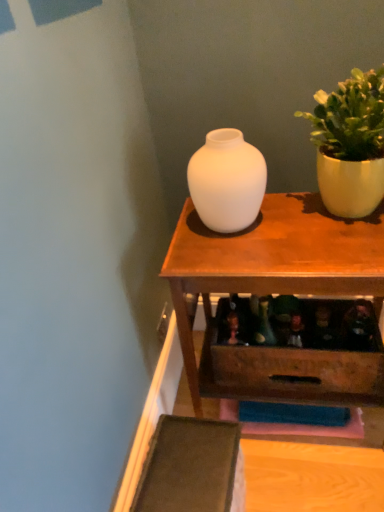
Question: From the image's perspective, is matte wood table at center below matte yellow pot at upper right?

Choices:
 (A) yes
 (B) no

Answer: (A)

Question: Does matte wood table at center have a greater width compared to matte yellow pot at upper right?

Choices:
 (A) no
 (B) yes

Answer: (B)

Question: Is matte wood table at center bigger than matte yellow pot at upper right?

Choices:
 (A) yes
 (B) no

Answer: (A)

Question: Considering the relative sizes of matte wood table at center and matte yellow pot at upper right in the image provided, is matte wood table at center smaller than matte yellow pot at upper right?

Choices:
 (A) yes
 (B) no

Answer: (B)

Question: Is matte wood table at center positioned far away from matte yellow pot at upper right?

Choices:
 (A) yes
 (B) no

Answer: (B)

Question: Looking at their shapes, would you say matte wood table at center is wider or thinner than matte yellow pot at upper right?

Choices:
 (A) thin
 (B) wide

Answer: (B)

Question: Does point (354, 276) appear closer or farther from the camera than point (337, 206)?

Choices:
 (A) closer
 (B) farther

Answer: (A)

Question: From the image's perspective, is matte wood table at center above or below matte yellow pot at upper right?

Choices:
 (A) above
 (B) below

Answer: (B)

Question: From a real-world perspective, relative to matte yellow pot at upper right, is matte wood table at center vertically above or below?

Choices:
 (A) above
 (B) below

Answer: (B)

Question: Based on their positions, is white matte vase at center located to the left or right of matte yellow pot at upper right?

Choices:
 (A) left
 (B) right

Answer: (A)

Question: Is point (254, 208) closer or farther from the camera than point (382, 66)?

Choices:
 (A) farther
 (B) closer

Answer: (B)

Question: Relative to matte yellow pot at upper right, is white matte vase at center in front or behind?

Choices:
 (A) front
 (B) behind

Answer: (B)

Question: Is white matte vase at center inside the boundaries of matte yellow pot at upper right, or outside?

Choices:
 (A) inside
 (B) outside

Answer: (B)

Question: Is matte yellow pot at upper right in front of or behind matte wood table at center in the image?

Choices:
 (A) front
 (B) behind

Answer: (A)

Question: From their relative heights in the image, would you say matte yellow pot at upper right is taller or shorter than matte wood table at center?

Choices:
 (A) tall
 (B) short

Answer: (B)